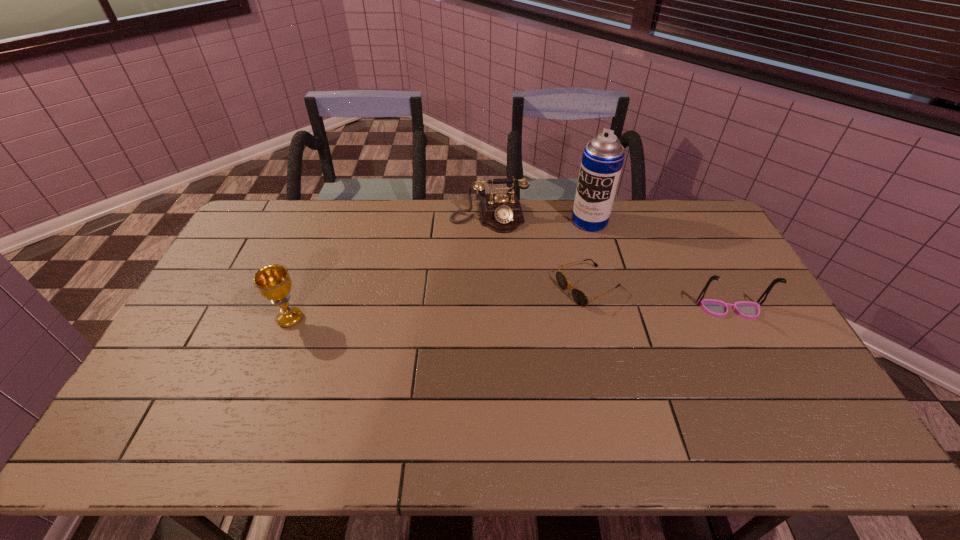
Where is `vacant region located 0.380m on the lenses of the shortest object`? This screenshot has width=960, height=540. vacant region located 0.380m on the lenses of the shortest object is located at coordinates (455, 353).

Find the location of a particular element. The height and width of the screenshot is (540, 960). free region located on the lenses of the shortest object is located at coordinates (461, 350).

I want to click on free location located on the lenses of the shortest object, so click(461, 350).

Identify the location of free space located on the label side of the aerosol can. (571, 242).

The height and width of the screenshot is (540, 960). Identify the location of vacant area situated 0.090m on the label side of the aerosol can. (570, 244).

What are the coordinates of `blank space located on the label side of the aerosol can` in the screenshot? It's located at (524, 298).

Where is `telephone located at the far edge`? Image resolution: width=960 pixels, height=540 pixels. telephone located at the far edge is located at coordinates tap(502, 213).

The width and height of the screenshot is (960, 540). Find the location of `aerosol can that is at the far edge`. aerosol can that is at the far edge is located at coordinates (602, 160).

Identify the location of object at the right edge. (748, 310).

The height and width of the screenshot is (540, 960). I want to click on free space at the far edge of the desktop, so click(630, 227).